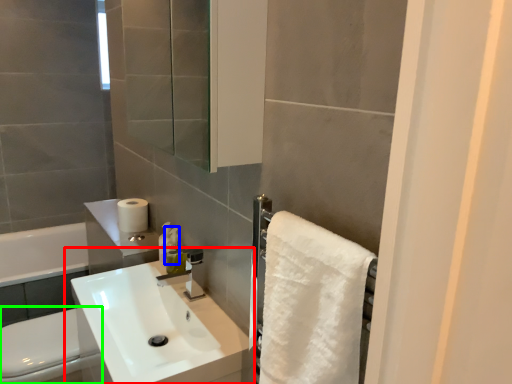
Question: Based on their relative distances, which object is nearer to sink (highlighted by a red box)? Choose from soap dispenser (highlighted by a blue box) and toilet bowl (highlighted by a green box).

Choices:
 (A) soap dispenser
 (B) toilet bowl

Answer: (B)